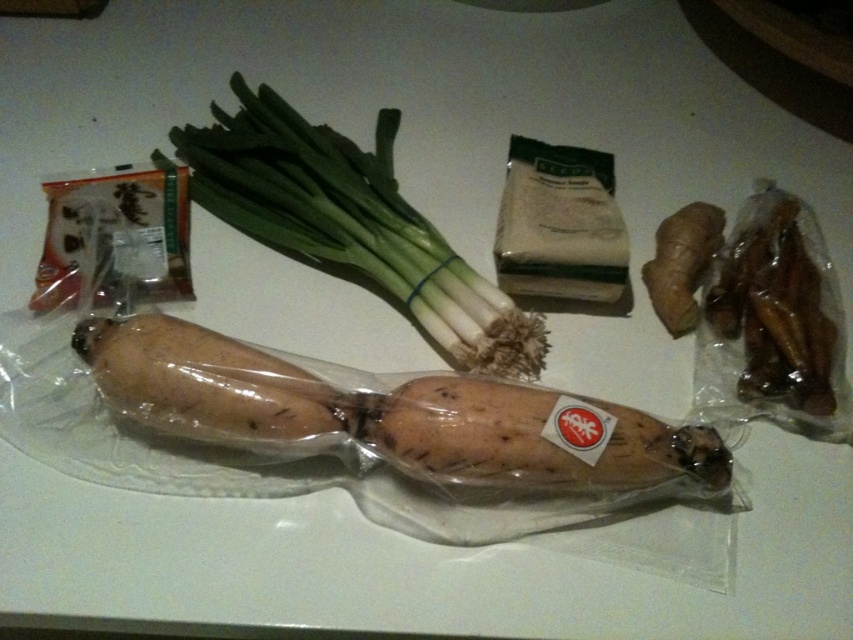
You are organizing a pantry and need to place the brown glossy dried mushrooms at right and the brown rough ginger at upper right on a shelf. Which item should you place first if you want to arrange them from tallest to shortest?

The brown glossy dried mushrooms at right should be placed first since it is taller than the brown rough ginger at upper right, allowing you to arrange them from tallest to shortest.

You are arranging food items on a kitchen counter. You have a brown matte sweet potato at center and a brown rough ginger at upper right. Which item is located to the left of the other?

The brown matte sweet potato at center is positioned on the left side of brown rough ginger at upper right.

You are organizing groceries on a shelf and need to place the brown matte sweet potato at center and the brown glossy dried mushrooms at right. Since the sweet potato is in front, which item will be more visible from the front of the shelf?

The brown matte sweet potato at center will be more visible from the front of the shelf because it is positioned in front of the brown glossy dried mushrooms at right.